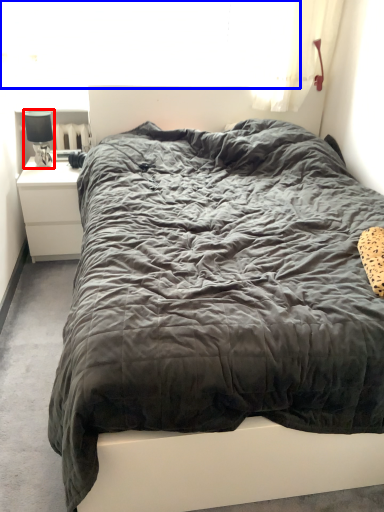
Question: Which point is closer to the camera, lamp (highlighted by a red box) or window screen (highlighted by a blue box)?

Choices:
 (A) lamp
 (B) window screen

Answer: (A)